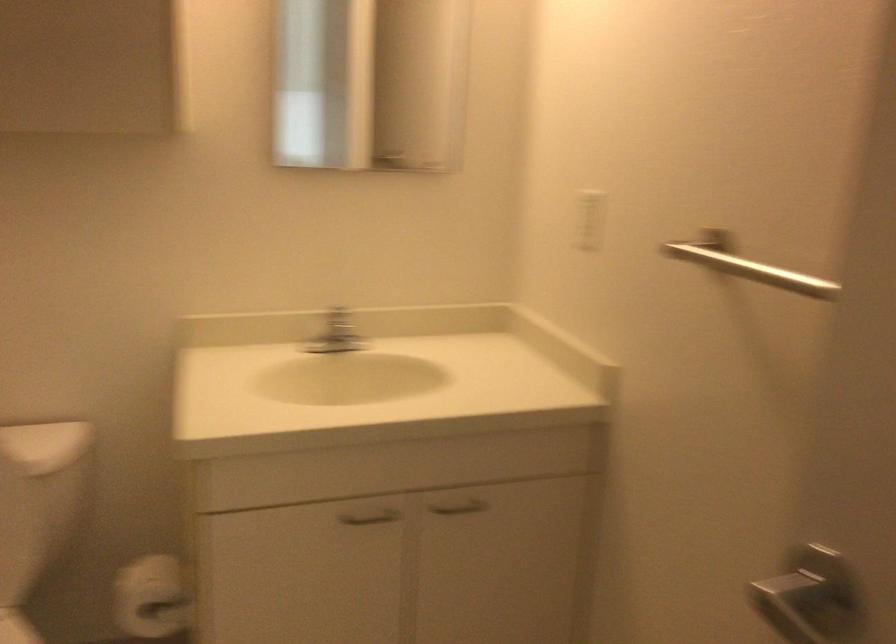
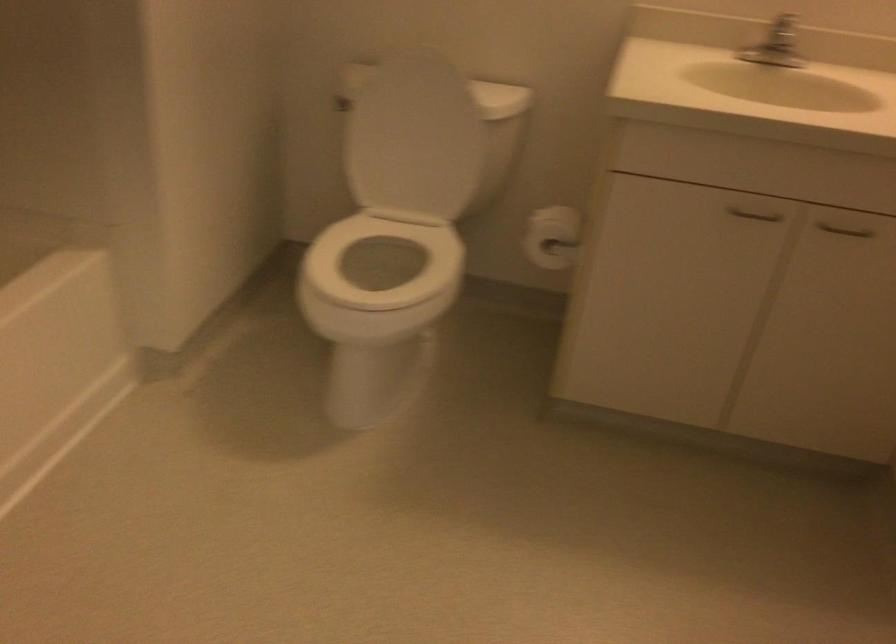
Where in the second image is the point corresponding to (x=375, y=522) from the first image?

(754, 214)